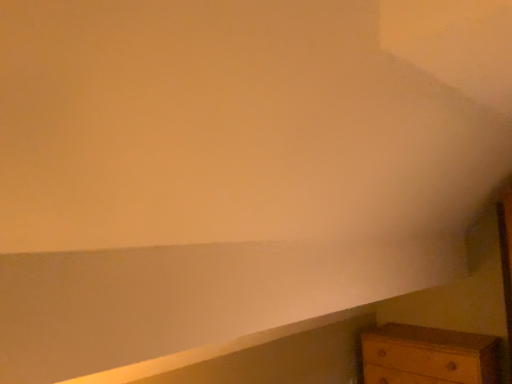
Measure the distance between wooden chest of drawers at lower right and camera.

2.75 meters.

This screenshot has height=384, width=512. What do you see at coordinates (428, 356) in the screenshot?
I see `wooden chest of drawers at lower right` at bounding box center [428, 356].

At what (x,y) coordinates should I click in order to perform the action: click on wooden chest of drawers at lower right. Please return your answer as a coordinate pair (x, y). This screenshot has height=384, width=512. Looking at the image, I should click on (428, 356).

Where is `wooden chest of drawers at lower right`? The image size is (512, 384). wooden chest of drawers at lower right is located at coordinates (428, 356).